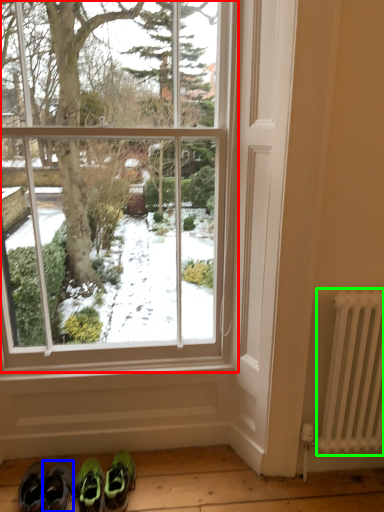
Question: Estimate the real-world distances between objects in this image. Which object is farther from window (highlighted by a red box), footwear (highlighted by a blue box) or radiator (highlighted by a green box)?

Choices:
 (A) footwear
 (B) radiator

Answer: (A)